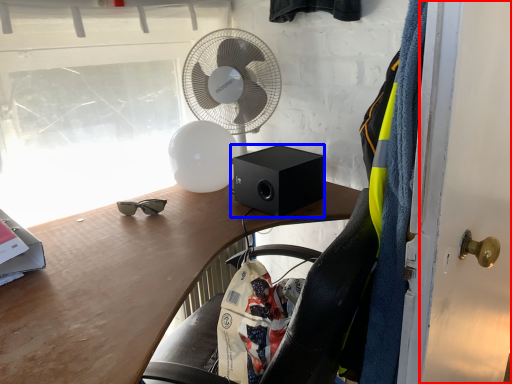
Question: Which point is closer to the camera, door (highlighted by a red box) or loudspeaker (highlighted by a blue box)?

Choices:
 (A) door
 (B) loudspeaker

Answer: (A)